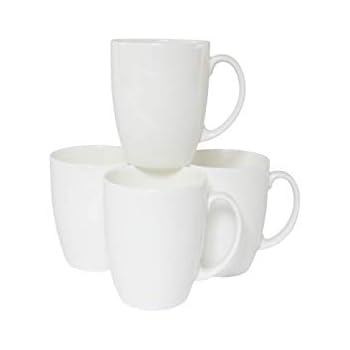
The height and width of the screenshot is (350, 350). I want to click on white mug, so click(x=152, y=110), click(x=175, y=261), click(x=82, y=197), click(x=251, y=161).